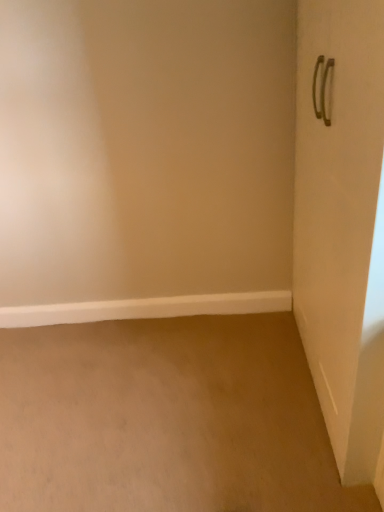
I want to click on vacant space in front of white smooth baseboard at lower left, so click(153, 397).